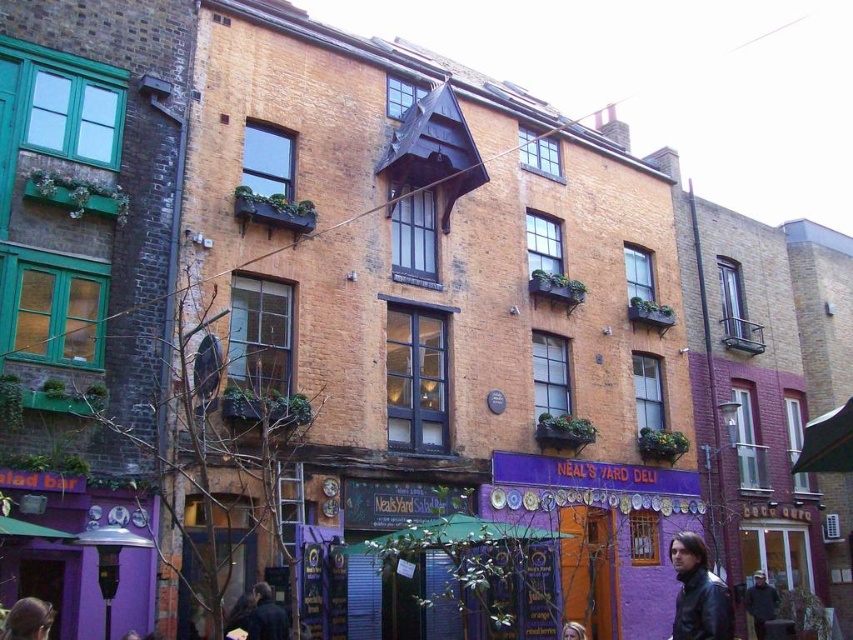
Which of these two, dark brown hair at lower left or dark blue jacket at lower left, stands taller?

dark blue jacket at lower left

Identify the location of dark brown hair at lower left. (28, 620).

Who is more distant from viewer, (x=10, y=608) or (x=572, y=627)?

Positioned behind is point (x=10, y=608).

Is dark brown hair at lower left to the right of blonde hair at center from the viewer's perspective?

In fact, dark brown hair at lower left is to the left of blonde hair at center.

Between point (21, 614) and point (575, 632), which one is positioned in front?

Point (21, 614)

You are a GUI agent. You are given a task and a screenshot of the screen. Output one action in this format:
    pyautogui.click(x=<x>, y=<y>)
    Task: Click on the dark brown hair at lower left
    This screenshot has width=853, height=640.
    Given the screenshot: What is the action you would take?
    pyautogui.click(x=28, y=620)

At what (x,y) coordinates should I click in order to perform the action: click on dark blue jacket at lower left. Please return your answer as a coordinate pair (x, y). Looking at the image, I should click on (265, 616).

What do you see at coordinates (265, 616) in the screenshot?
I see `dark blue jacket at lower left` at bounding box center [265, 616].

Where is `dark blue jacket at lower left`? dark blue jacket at lower left is located at coordinates (265, 616).